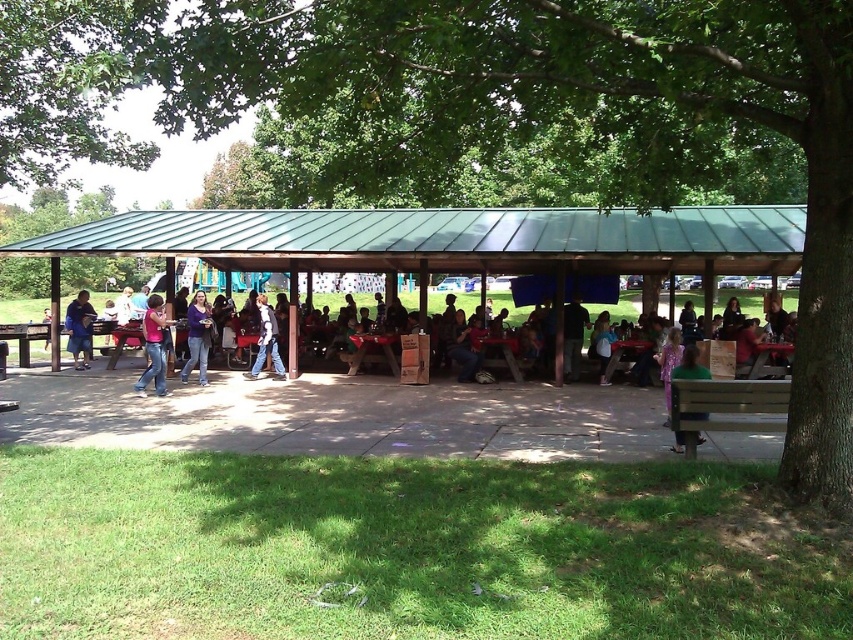
Question: Considering the real-world distances, which object is farthest from the matte pink shirt at center?

Choices:
 (A) denim jacket at center
 (B) wooden park bench at lower right
 (C) green matte shirt at lower right

Answer: (C)

Question: Is wooden park bench at lower right to the left of blue denim jacket at left from the viewer's perspective?

Choices:
 (A) yes
 (B) no

Answer: (B)

Question: Considering the real-world distances, which object is farthest from the denim jacket at center?

Choices:
 (A) matte pink shirt at center
 (B) pink fabric shirt at left
 (C) green matte shirt at lower right

Answer: (C)

Question: Is the position of matte pink shirt at center more distant than that of black matte jacket at center?

Choices:
 (A) yes
 (B) no

Answer: (B)

Question: Is pink fabric shirt at left behind blue denim jacket at left?

Choices:
 (A) yes
 (B) no

Answer: (B)

Question: Considering the real-world distances, which object is farthest from the pink fabric shirt at left?

Choices:
 (A) blue denim jacket at left
 (B) green matte shirt at lower right
 (C) wooden park bench at lower right

Answer: (C)